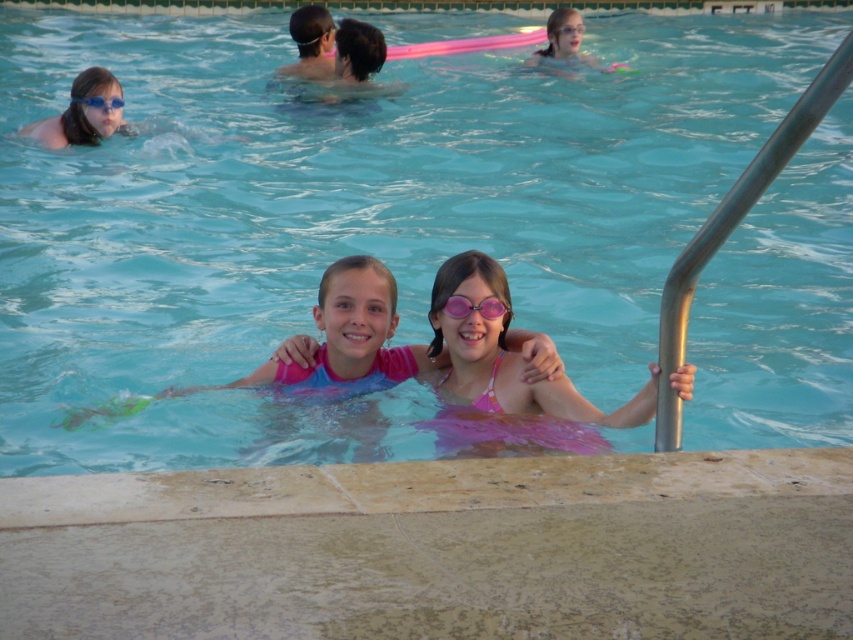
In the swimming pool scene, there are two young girls wearing swim caps and goggles. The point at coordinates (83,113) is part of an object in the image. What object is located at this point?

The point at coordinates (83,113) corresponds to the matte blue goggles at upper left.

You are a lifeguard who needs to place a 30 cm wide first aid kit on the smooth concrete edge at lower center. Can the pink matte goggles at center be placed next to the first aid kit without overlapping?

The smooth concrete edge at lower center might be wider than pink matte goggles at center, so there is a possibility that the first aid kit and the goggles can be placed next to each other without overlapping. However, since the exact width of the concrete edge is not specified, it is recommended to measure the space before placing them.

You are a photographer trying to capture a photo of the pink matte swimsuit at center and the matte blue goggles at upper left. Which object should you focus on first if you want to ensure both are in focus without adjusting the camera settings?

The pink matte swimsuit at center is much taller than the matte blue goggles at upper left, so focusing on the pink matte swimsuit at center first would ensure both are in focus because it is larger and closer to the camera.